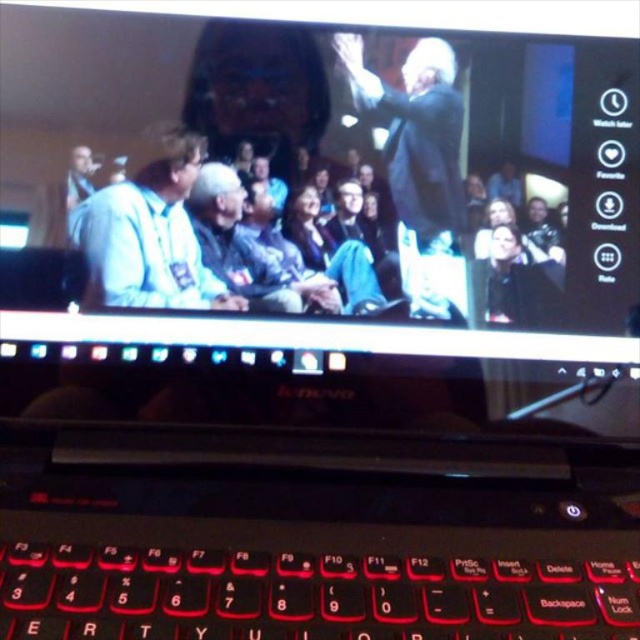
You are organizing a charity event and need to decide which of the two attendees, the dark gray suit at upper center or the black matte jacket at lower right, has a larger clothing size. Based on the image, which one should you choose?

The dark gray suit at upper center is bigger than the black matte jacket at lower right, so you should choose the dark gray suit at upper center as it has a larger clothing size.

You are attending a virtual conference and see the light blue fabric shirt at left and the black matte jacket at lower right on the laptop screen. Which clothing item appears larger in the image?

The light blue fabric shirt at left appears larger because it is taller than the black matte jacket at lower right.

You are holding a ruler and want to measure the distance from your eyes to the point marked at coordinates point (172, 593) on the laptop screen. According to the scene description, what is this distance?

The distance of point (172, 593) from viewer is 17.58 inches.